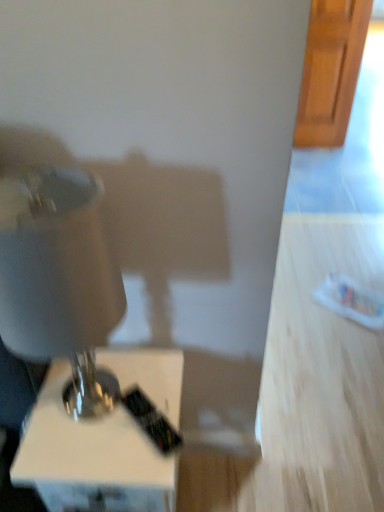
Question: Based on their sizes in the image, would you say white glossy sewing machine at left is bigger or smaller than white glossy lamp at lower left?

Choices:
 (A) small
 (B) big

Answer: (A)

Question: Considering the relative positions of white glossy sewing machine at left and white glossy lamp at lower left in the image provided, is white glossy sewing machine at left to the left or to the right of white glossy lamp at lower left?

Choices:
 (A) right
 (B) left

Answer: (B)

Question: Is point (66, 352) positioned closer to the camera than point (160, 387)?

Choices:
 (A) farther
 (B) closer

Answer: (B)

Question: From a real-world perspective, relative to white glossy sewing machine at left, is white glossy lamp at lower left vertically above or below?

Choices:
 (A) below
 (B) above

Answer: (A)

Question: From the image's perspective, relative to white glossy sewing machine at left, is white glossy lamp at lower left above or below?

Choices:
 (A) above
 (B) below

Answer: (B)

Question: Is white glossy lamp at lower left in front of or behind white glossy sewing machine at left in the image?

Choices:
 (A) behind
 (B) front

Answer: (A)

Question: Considering the positions of white glossy lamp at lower left and white glossy sewing machine at left in the image, is white glossy lamp at lower left taller or shorter than white glossy sewing machine at left?

Choices:
 (A) short
 (B) tall

Answer: (A)